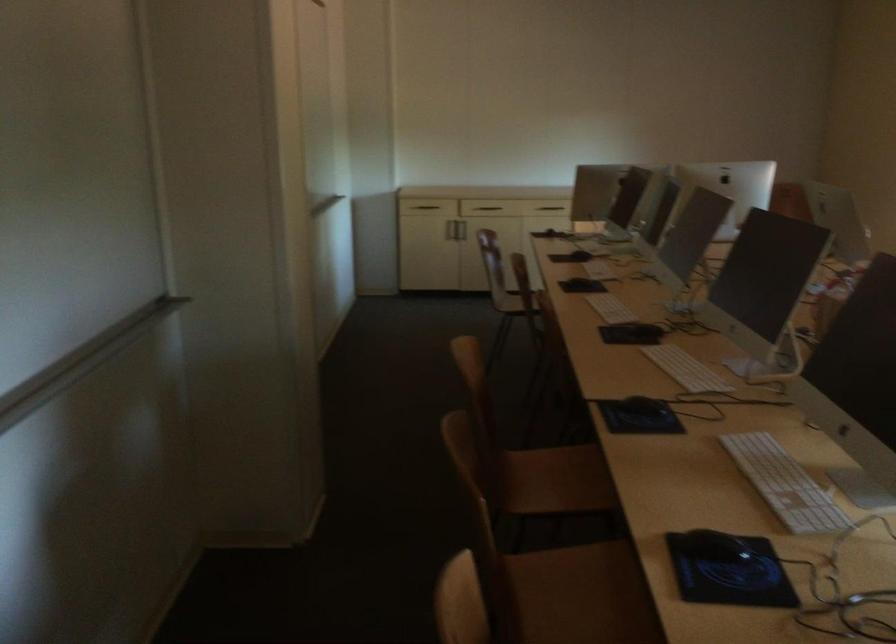
Image resolution: width=896 pixels, height=644 pixels. I want to click on wall-mounted handrail, so click(x=82, y=361).